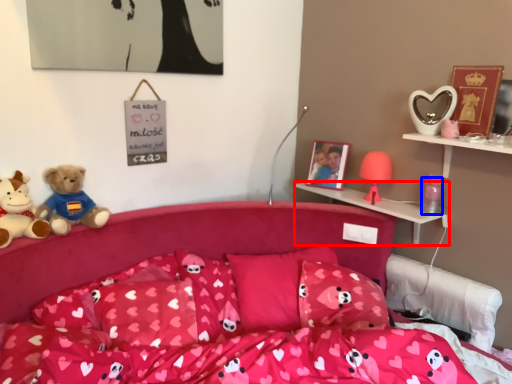
Question: Which of the following is the farthest to the observer, shelf (highlighted by a red box) or toy (highlighted by a blue box)?

Choices:
 (A) shelf
 (B) toy

Answer: (B)